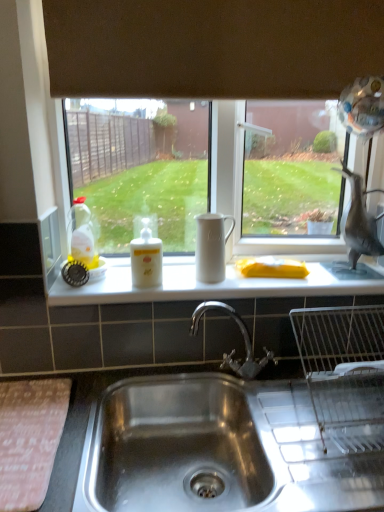
Question: Is stainless steel sink at lower center positioned in front of white matte counter top at center?

Choices:
 (A) no
 (B) yes

Answer: (B)

Question: From a real-world perspective, is stainless steel sink at lower center on top of white matte counter top at center?

Choices:
 (A) no
 (B) yes

Answer: (A)

Question: From the image's perspective, is stainless steel sink at lower center under white matte counter top at center?

Choices:
 (A) yes
 (B) no

Answer: (A)

Question: Can you confirm if stainless steel sink at lower center is shorter than white matte counter top at center?

Choices:
 (A) no
 (B) yes

Answer: (A)

Question: Is stainless steel sink at lower center at the left side of white matte counter top at center?

Choices:
 (A) yes
 (B) no

Answer: (B)

Question: From a real-world perspective, is white matte counter top at center positioned above or below translucent yellow liquid at bottle left, arranged as the second bottle when viewed from the right?

Choices:
 (A) below
 (B) above

Answer: (A)

Question: Looking at the image, does white matte counter top at center seem bigger or smaller compared to translucent yellow liquid at bottle left, the 1th bottle viewed from the left?

Choices:
 (A) small
 (B) big

Answer: (B)

Question: Is white matte counter top at center taller or shorter than translucent yellow liquid at bottle left, arranged as the second bottle when viewed from the right?

Choices:
 (A) tall
 (B) short

Answer: (B)

Question: Would you say white matte counter top at center is to the left or to the right of translucent yellow liquid at bottle left, arranged as the second bottle when viewed from the right, in the picture?

Choices:
 (A) right
 (B) left

Answer: (A)

Question: From their relative heights in the image, would you say translucent yellow liquid at bottle left, the 1th bottle viewed from the left, is taller or shorter than stainless steel sink at lower center?

Choices:
 (A) tall
 (B) short

Answer: (B)

Question: Based on their positions, is translucent yellow liquid at bottle left, arranged as the second bottle when viewed from the right, located to the left or right of stainless steel sink at lower center?

Choices:
 (A) right
 (B) left

Answer: (B)

Question: From a real-world perspective, is translucent yellow liquid at bottle left, the 1th bottle viewed from the left, positioned above or below stainless steel sink at lower center?

Choices:
 (A) below
 (B) above

Answer: (B)

Question: Considering the positions of translucent yellow liquid at bottle left, arranged as the second bottle when viewed from the right, and stainless steel sink at lower center in the image, is translucent yellow liquid at bottle left, arranged as the second bottle when viewed from the right, wider or thinner than stainless steel sink at lower center?

Choices:
 (A) wide
 (B) thin

Answer: (B)

Question: In terms of height, does brown matte exhaust hood at upper center look taller or shorter compared to white matte bottle at center, which is counted as the 2th bottle, starting from the left?

Choices:
 (A) short
 (B) tall

Answer: (B)

Question: From a real-world perspective, is brown matte exhaust hood at upper center positioned above or below white matte bottle at center, which is counted as the 2th bottle, starting from the left?

Choices:
 (A) above
 (B) below

Answer: (A)